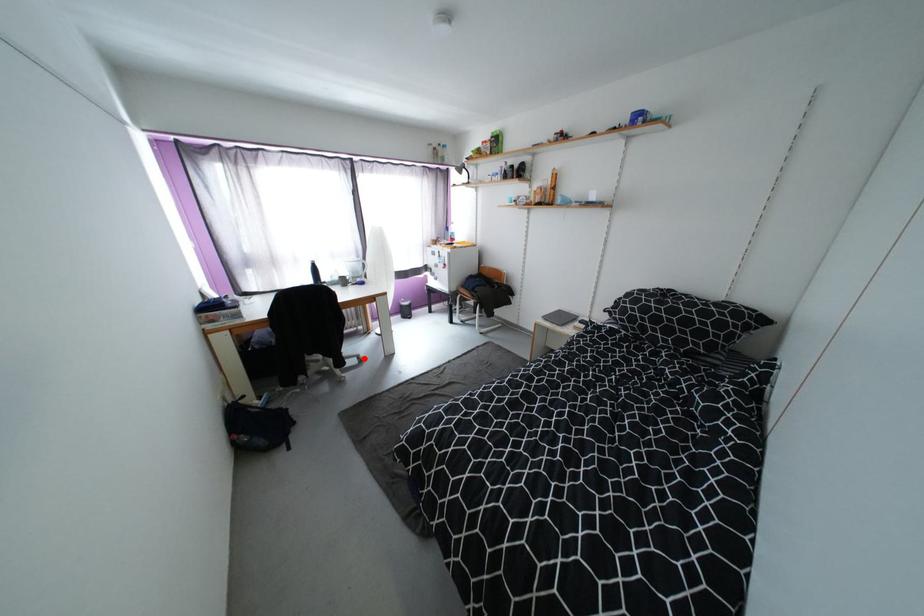
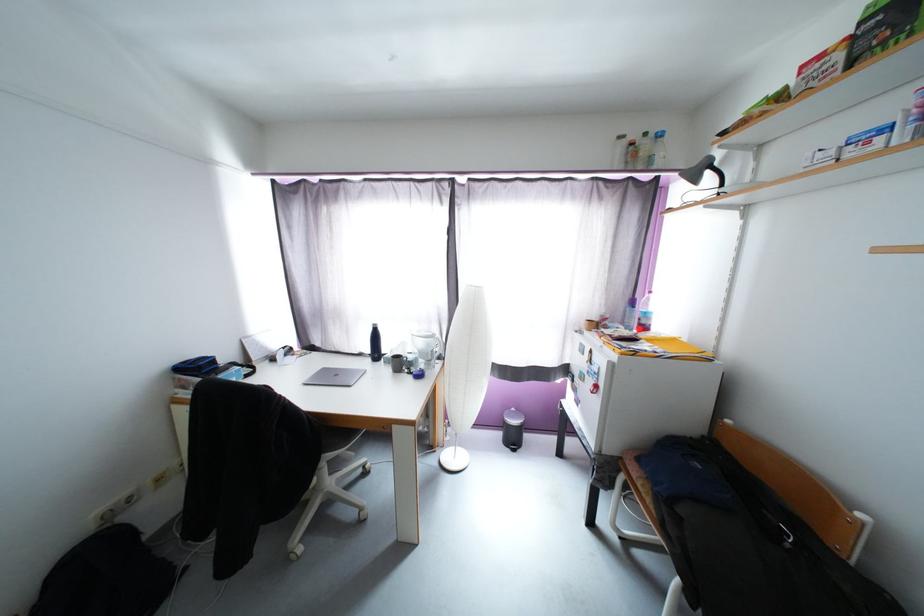
Where in the second image is the point corresponding to the highlighted location from the first image?

(367, 511)